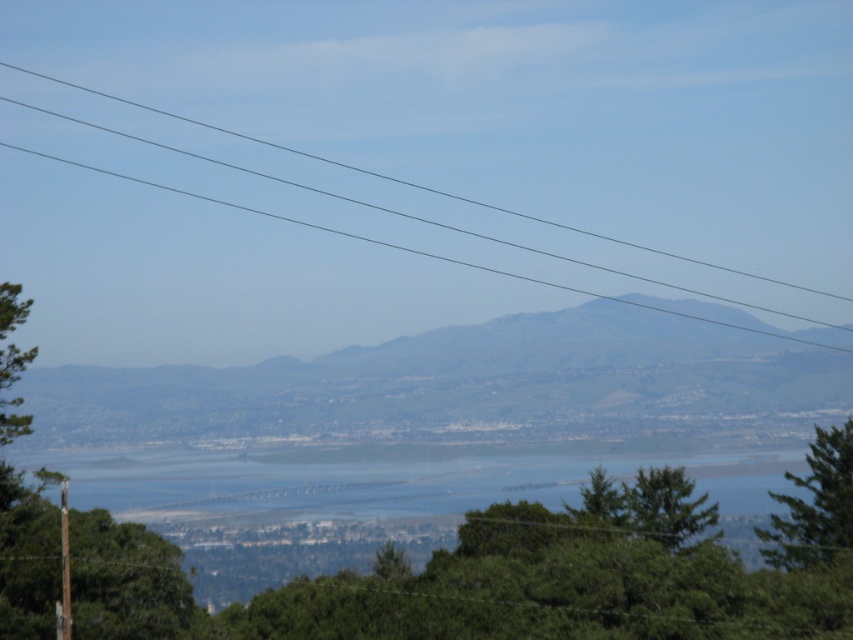
Question: Does green matte tree at left lie behind green matte tree at center?

Choices:
 (A) yes
 (B) no

Answer: (B)

Question: Which point is closer to the camera?

Choices:
 (A) (659, 502)
 (B) (3, 420)

Answer: (B)

Question: Does clear wire at upper center lie behind green leafy tree at center?

Choices:
 (A) yes
 (B) no

Answer: (A)

Question: Which is nearer to the green grassy mountain at center?

Choices:
 (A) clear wire at upper center
 (B) green matte tree at center
 (C) green matte tree at left
 (D) green leafy tree at lower right

Answer: (A)

Question: Which object is the closest to the clear wire at upper center?

Choices:
 (A) green leafy tree at center
 (B) green matte tree at center
 (C) green leafy tree at lower right

Answer: (C)

Question: Does green matte tree at left have a larger size compared to green matte tree at center?

Choices:
 (A) no
 (B) yes

Answer: (B)